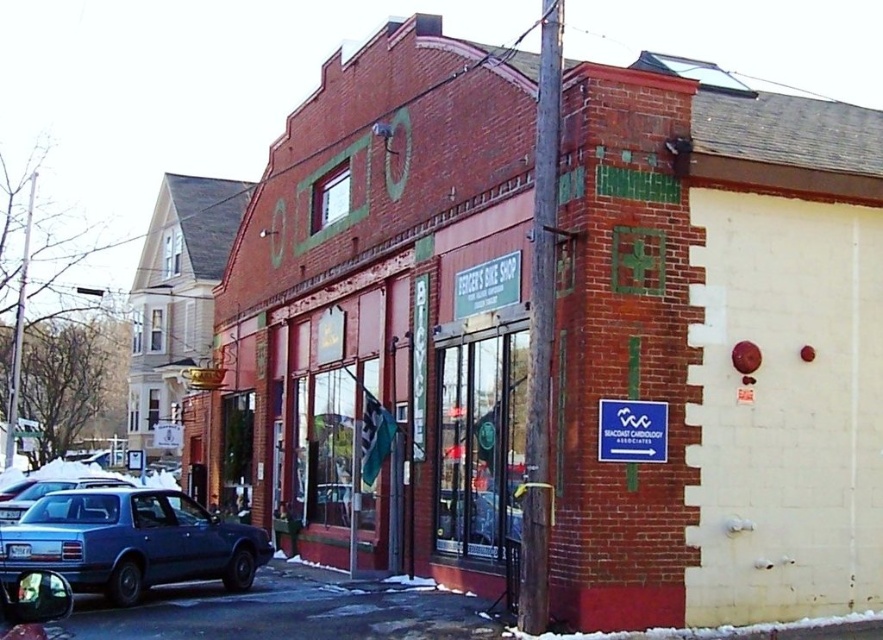
Does matte blue sedan at lower left have a lesser height compared to brown wooden pole at center?

In fact, matte blue sedan at lower left may be taller than brown wooden pole at center.

Does matte blue sedan at lower left appear on the right side of brown wooden pole at center?

No, matte blue sedan at lower left is not to the right of brown wooden pole at center.

This screenshot has width=883, height=640. What do you see at coordinates (130, 541) in the screenshot?
I see `matte blue sedan at lower left` at bounding box center [130, 541].

At what (x,y) coordinates should I click in order to perform the action: click on matte blue sedan at lower left. Please return your answer as a coordinate pair (x, y). The width and height of the screenshot is (883, 640). Looking at the image, I should click on (130, 541).

Does matte blue sedan at lower left have a lesser height compared to blue plastic sign at center?

Incorrect, matte blue sedan at lower left's height does not fall short of blue plastic sign at center's.

You are a GUI agent. You are given a task and a screenshot of the screen. Output one action in this format:
    pyautogui.click(x=<x>, y=<y>)
    Task: Click on the matte blue sedan at lower left
    The width and height of the screenshot is (883, 640).
    Given the screenshot: What is the action you would take?
    pyautogui.click(x=130, y=541)

Which is behind, point (121, 557) or point (608, 458)?

The point (121, 557) is behind.

At what (x,y) coordinates should I click in order to perform the action: click on matte blue sedan at lower left. Please return your answer as a coordinate pair (x, y). The width and height of the screenshot is (883, 640). Looking at the image, I should click on (130, 541).

What do you see at coordinates (631, 429) in the screenshot? I see `blue plastic sign at center` at bounding box center [631, 429].

At what (x,y) coordinates should I click in order to perform the action: click on blue plastic sign at center. Please return your answer as a coordinate pair (x, y). Looking at the image, I should click on (631, 429).

Is point (598, 406) more distant than point (76, 486)?

No, (598, 406) is in front of (76, 486).

This screenshot has height=640, width=883. In order to click on blue plastic sign at center in this screenshot , I will do `click(631, 429)`.